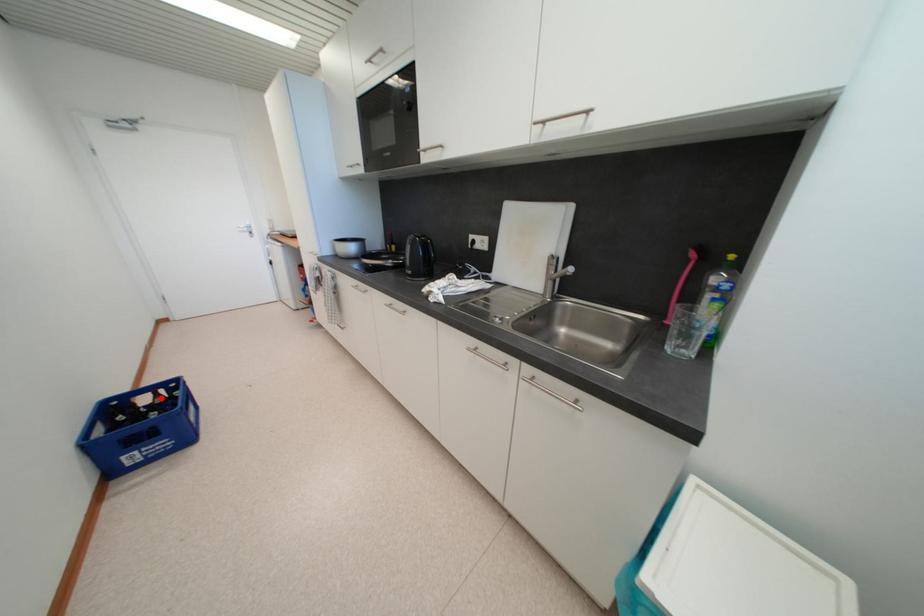
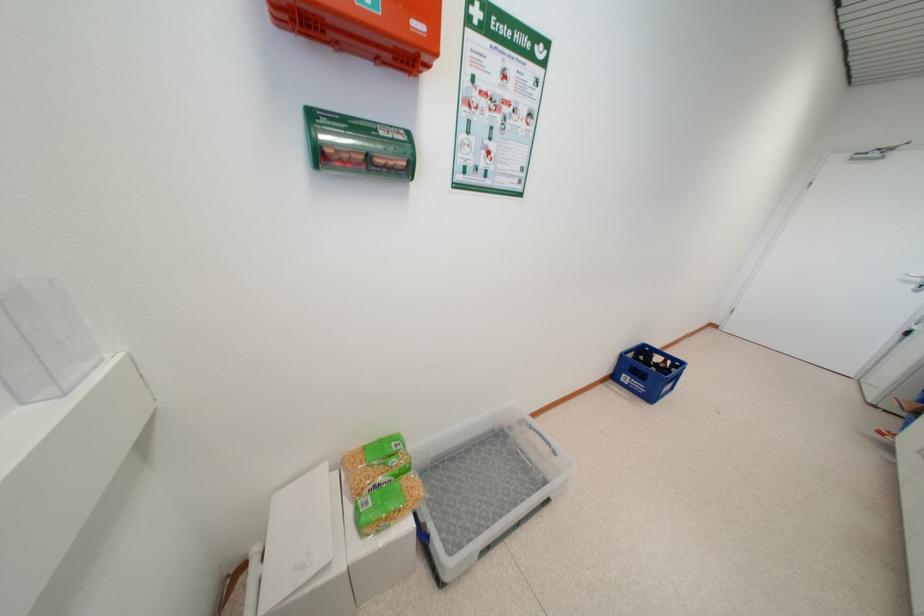
The point at the highlighted location is marked in the first image. Where is the corresponding point in the second image?

(669, 363)